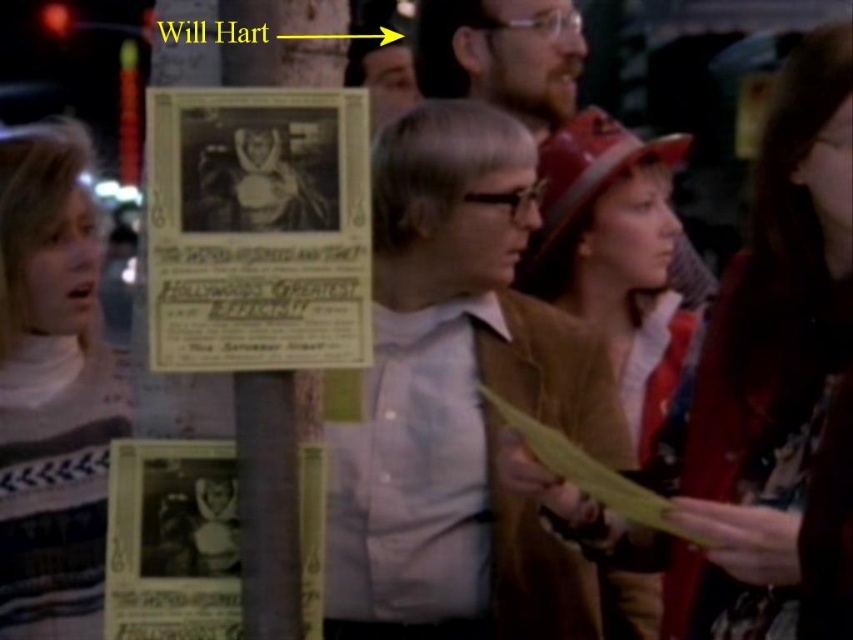
Question: Is light brown suede jacket at center closer to camera compared to striped sweater at left?

Choices:
 (A) no
 (B) yes

Answer: (B)

Question: Can you confirm if light brown suede jacket at center is positioned below striped sweater at left?

Choices:
 (A) no
 (B) yes

Answer: (A)

Question: Which object is farther from the camera taking this photo?

Choices:
 (A) light brown suede jacket at center
 (B) bearded man with glasses at upper center
 (C) striped sweater at left

Answer: (B)

Question: Which point is farther from the camera taking this photo?

Choices:
 (A) (77, 282)
 (B) (395, 177)
 (C) (196, 164)
 (D) (665, 289)

Answer: (D)

Question: Which object appears closest to the camera in this image?

Choices:
 (A) yellow paper poster at center
 (B) striped sweater at left

Answer: (A)

Question: Does light brown suede jacket at center appear on the right side of striped sweater at left?

Choices:
 (A) no
 (B) yes

Answer: (B)